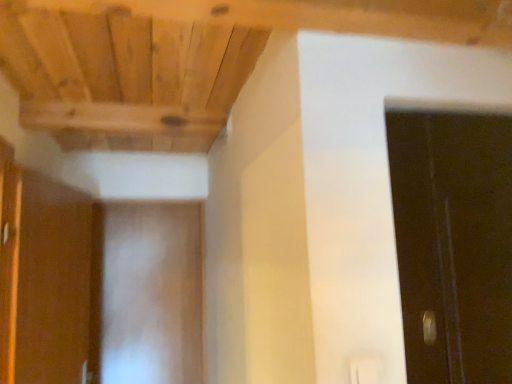
Question: Choose the correct answer: Is white matte door at center inside brown wood cabinet at left or outside it?

Choices:
 (A) outside
 (B) inside

Answer: (A)

Question: Is white matte door at center taller or shorter than brown wood cabinet at left?

Choices:
 (A) tall
 (B) short

Answer: (A)

Question: Is white matte door at center wider or thinner than brown wood cabinet at left?

Choices:
 (A) thin
 (B) wide

Answer: (A)

Question: From the image's perspective, is brown wood cabinet at left positioned above or below white matte door at center?

Choices:
 (A) above
 (B) below

Answer: (A)

Question: Looking at the image, does brown wood cabinet at left seem bigger or smaller compared to white matte door at center?

Choices:
 (A) big
 (B) small

Answer: (A)

Question: Is brown wood cabinet at left wider or thinner than white matte door at center?

Choices:
 (A) wide
 (B) thin

Answer: (A)

Question: In the image, is brown wood cabinet at left on the left side or the right side of white matte door at center?

Choices:
 (A) right
 (B) left

Answer: (B)